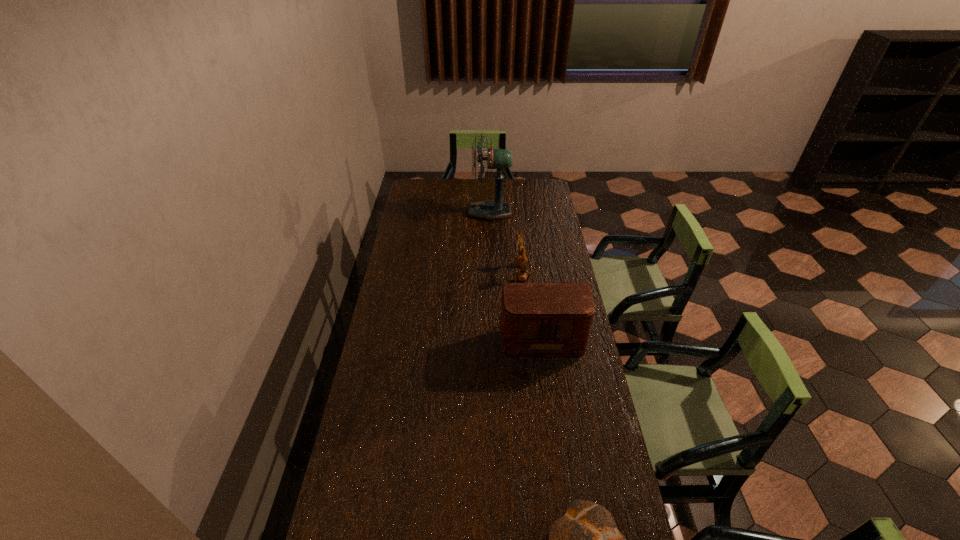
At what (x,y) coordinates should I click in order to perform the action: click on vacant space that is in between the radio receiver and the tallest object. Please return your answer as a coordinate pair (x, y). The width and height of the screenshot is (960, 540). Looking at the image, I should click on (516, 274).

In order to click on vacant space in between the earphone and the fan in this screenshot , I will do `click(505, 243)`.

This screenshot has height=540, width=960. I want to click on free space between the second farthest object and the farthest object, so click(505, 243).

You are a GUI agent. You are given a task and a screenshot of the screen. Output one action in this format:
    pyautogui.click(x=<x>, y=<y>)
    Task: Click on the object that can be found as the second closest to the second shortest object
    
    Given the screenshot: What is the action you would take?
    pyautogui.click(x=490, y=210)

Identify the location of object that stands as the closest to the earphone. (544, 321).